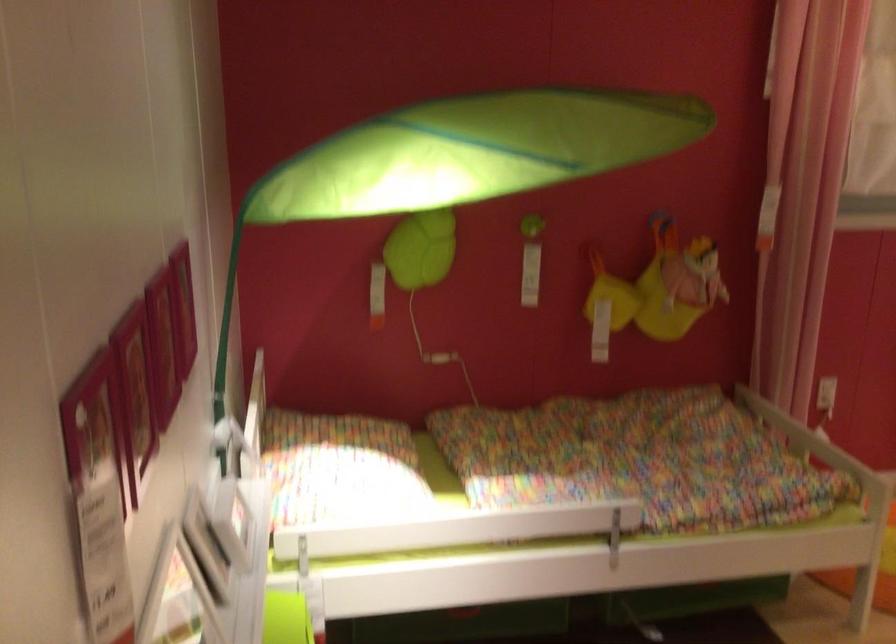
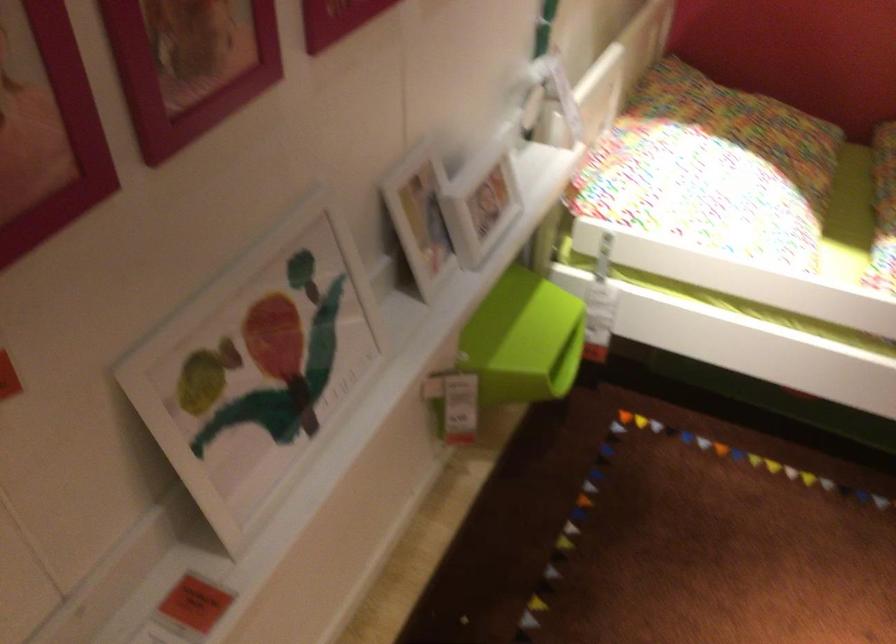
Locate, in the second image, the point that corresponds to the point at 350,476 in the first image.

(712, 169)